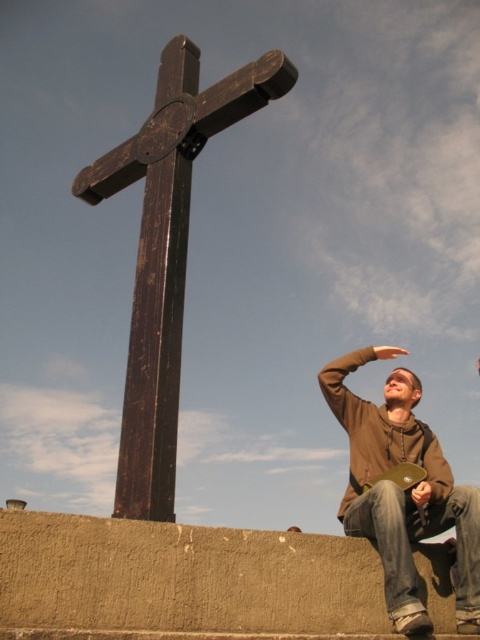
Question: Can you confirm if dark wood cross at center is positioned above brown hoodie at lower right?

Choices:
 (A) yes
 (B) no

Answer: (A)

Question: Which point is farther from the camera taking this photo?

Choices:
 (A) (168, 490)
 (B) (408, 602)

Answer: (B)

Question: Among these points, which one is nearest to the camera?

Choices:
 (A) coord(145,484)
 (B) coord(335,390)

Answer: (A)

Question: Does dark wood cross at center appear over brown hoodie at lower right?

Choices:
 (A) yes
 (B) no

Answer: (A)

Question: Is dark wood cross at center wider than brown hoodie at lower right?

Choices:
 (A) yes
 (B) no

Answer: (A)